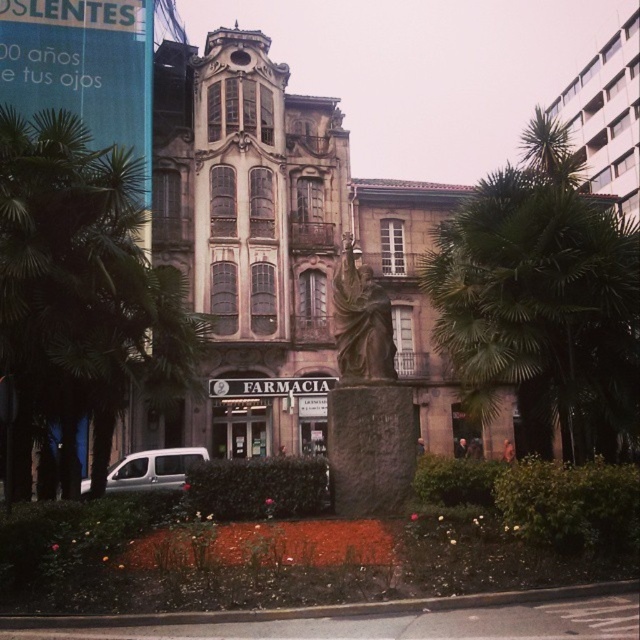
Question: Which object is closer to the camera taking this photo?

Choices:
 (A) white matte van at lower left
 (B) green leafy palm tree at left
 (C) green leafy palm tree at center

Answer: (B)

Question: Estimate the real-world distances between objects in this image. Which object is farther from the green leafy palm tree at center?

Choices:
 (A) green leafy palm tree at left
 (B) white matte van at lower left

Answer: (A)

Question: Does green leafy palm tree at left have a smaller size compared to white matte van at lower left?

Choices:
 (A) yes
 (B) no

Answer: (B)

Question: From the image, what is the correct spatial relationship of green leafy palm tree at left in relation to white matte van at lower left?

Choices:
 (A) left
 (B) right

Answer: (A)

Question: Estimate the real-world distances between objects in this image. Which object is closer to the white matte van at lower left?

Choices:
 (A) green leafy palm tree at center
 (B) green leafy palm tree at left

Answer: (B)

Question: From the image, what is the correct spatial relationship of green leafy palm tree at left in relation to white matte van at lower left?

Choices:
 (A) above
 (B) below

Answer: (A)